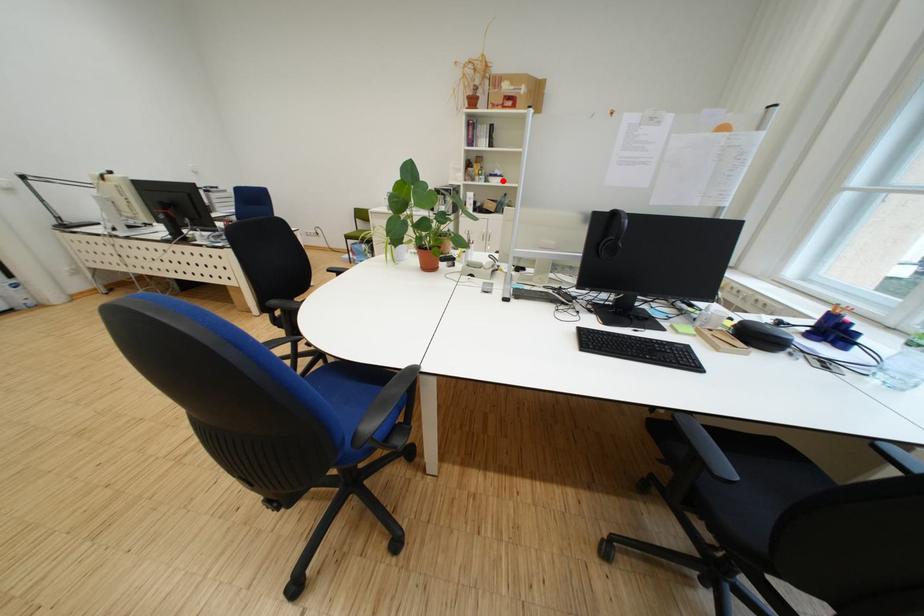
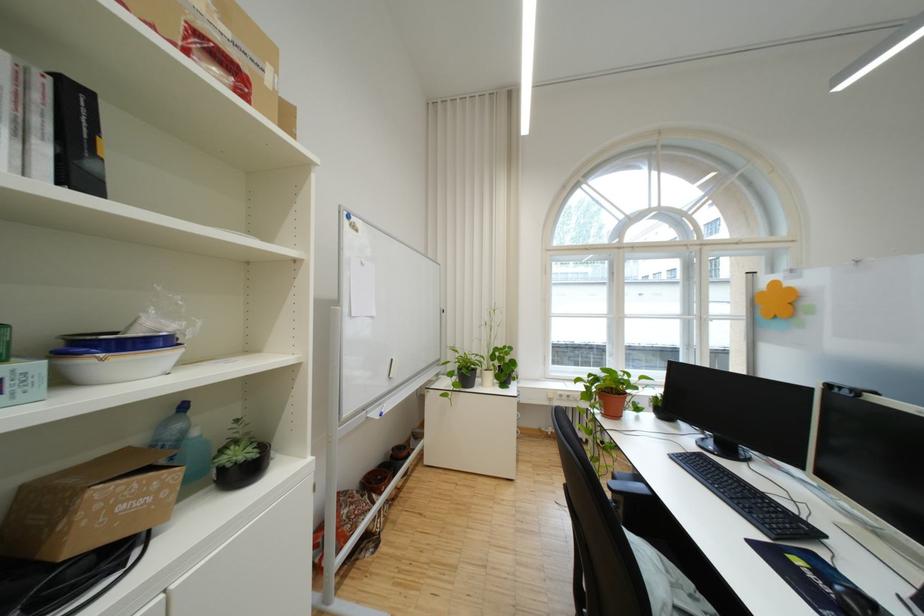
Where in the second image is the point corresponding to the highlighted location from the first image?

(117, 365)